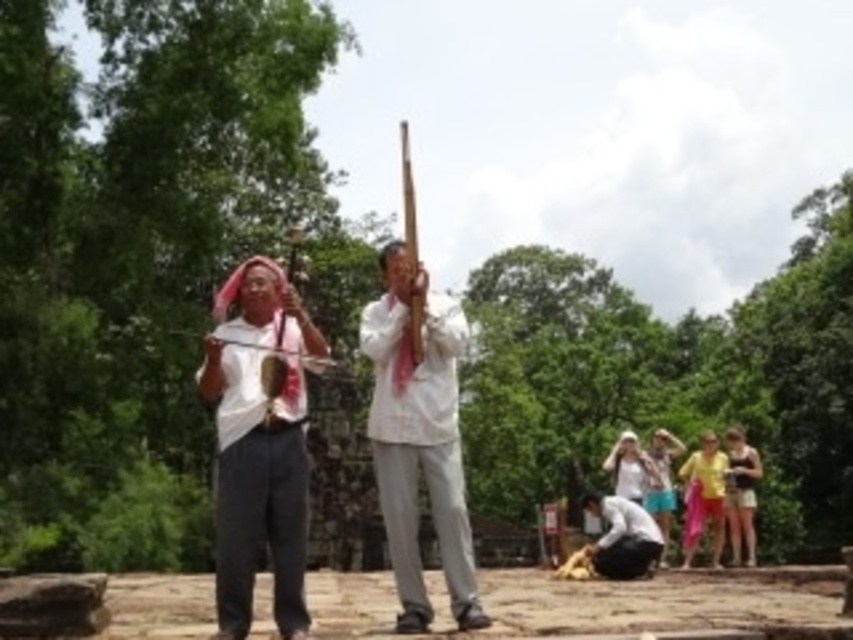
Question: Is white matte shirt at center thinner than white matte/soft cloth at center?

Choices:
 (A) yes
 (B) no

Answer: (B)

Question: Which object is closer to the camera taking this photo?

Choices:
 (A) white matte shirt at center
 (B) white matte/soft cloth at center

Answer: (A)

Question: Which of the following is the farthest from the observer?

Choices:
 (A) white matte/soft cloth at center
 (B) white matte shirt at center

Answer: (A)

Question: Which object is closer to the camera taking this photo?

Choices:
 (A) white matte/soft cloth at center
 (B) white matte shirt at center

Answer: (B)

Question: Is white matte shirt at center wider than white matte/soft cloth at center?

Choices:
 (A) yes
 (B) no

Answer: (A)

Question: Does white matte shirt at center appear on the left side of white matte/soft cloth at center?

Choices:
 (A) no
 (B) yes

Answer: (B)